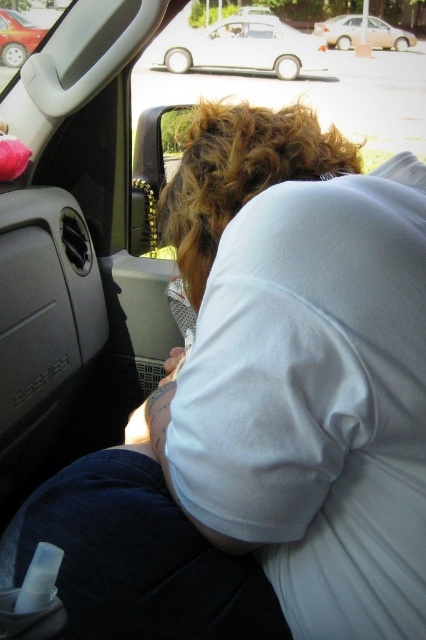
You are inside the car and want to reach both the point at (230, 33) and the point at (25, 17). Which point is closer to you?

Point (25, 17) is closer to you because it is in front of point (230, 33).

You are a passenger in the backseat of the car and want to know which car outside the door is closer to you. Based on their sizes, can you determine which one is the beige matte sedan at upper center or the metallic red car at upper left?

The beige matte sedan at upper center is smaller than the metallic red car at upper left, so the metallic red car at upper left is closer to you because larger objects appear bigger when they are nearer.